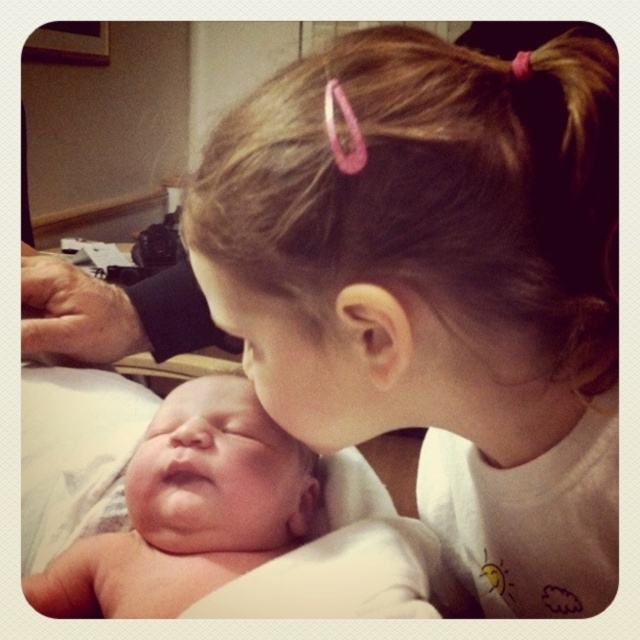
Which is more to the right, white soft hair at upper center or pink skin newborn at lower left?

From the viewer's perspective, white soft hair at upper center appears more on the right side.

Does white soft hair at upper center have a larger size compared to pink skin newborn at lower left?

Correct, white soft hair at upper center is larger in size than pink skin newborn at lower left.

Which is in front, point (250, 124) or point (42, 579)?

Point (250, 124) is in front.

You are a GUI agent. You are given a task and a screenshot of the screen. Output one action in this format:
    pyautogui.click(x=<x>, y=<y>)
    Task: Click on the white soft hair at upper center
    Image resolution: width=640 pixels, height=640 pixels.
    Given the screenshot: What is the action you would take?
    pyautogui.click(x=438, y=285)